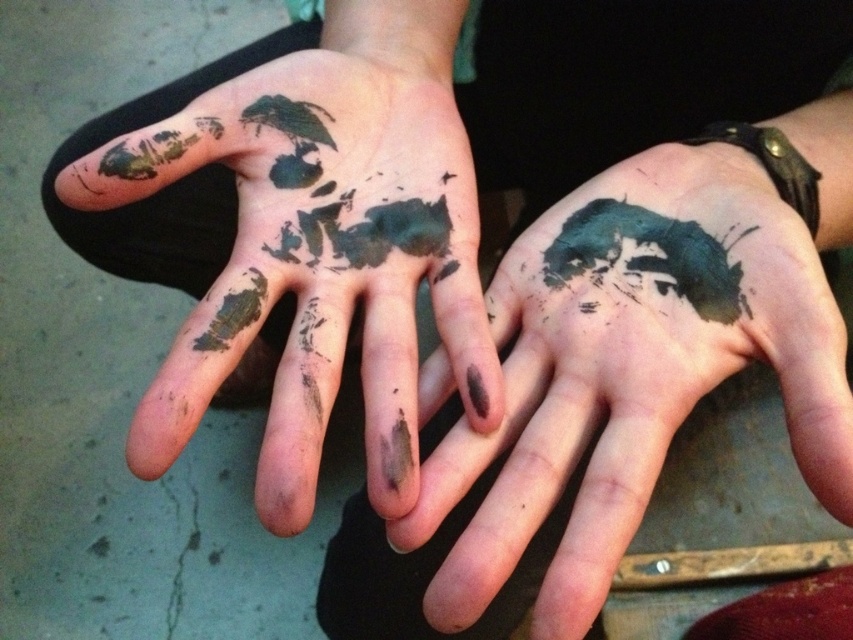
You are an artist who wants to create a new design using the watercolor ink cat at center and the green matte paint splatter at center. Based on their sizes, which object should you place first to ensure the smaller one is visible?

The green matte paint splatter at center is smaller than the watercolor ink cat at center, so you should place the green matte paint splatter at center first to ensure it remains visible.

You are an artist analyzing the composition of the image. You notice the dark green paint at center and the green matte paint splatter at center. Which of these two elements is located more to the right side of the image?

The dark green paint at center is positioned on the right side of the green matte paint splatter at center, so it is more to the right.

From the picture: You are an artist trying to place a new sticker between the watercolor ink cat at center and the green matte paint splatter at center. The sticker is 10 inches long. Can you fit it between them without overlapping either?

The distance between the watercolor ink cat at center and the green matte paint splatter at center is 8.70 inches. Since the sticker is 10 inches long, it cannot fit between them without overlapping either object.